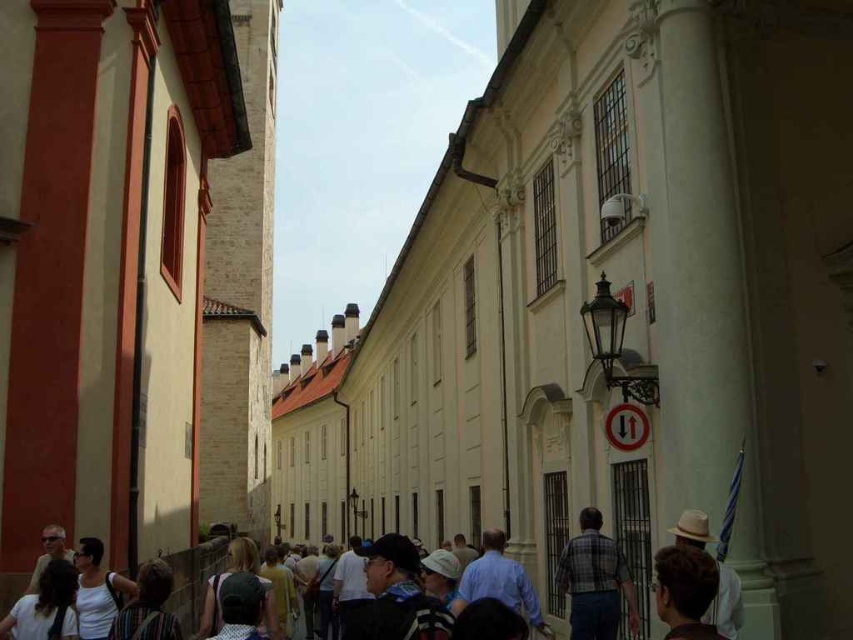
You are a tourist standing on the narrow street scene in a historic European city. You notice a dark brown hair at lower left. Where exactly is the dark brown hair located in the scene?

The dark brown hair at lower left is located at point coordinates of approximately 0.948 on the x axis and 0.054 on the y axis.

You are a delivery person carrying a package that is 1.2 meters wide. You see a dark blue jacket at center and a dark gray backpack at center in the middle of the narrow street. Can you pass through between them without moving the objects?

The dark blue jacket at center is narrower than the dark gray backpack at center. However, since both are at the center of the narrow street, their combined width may block the path. The package is 1.2 meters wide, but without knowing the exact spacing between the objects and the total available width, it is uncertain if the package can pass through safely.

You are a delivery person standing on the narrow street depicted in the image. You need to deliver a package to the building with the vertical red stripe on its left side. However, your delivery cart is 2 meters wide. Can you maneuver your cart between the dark brown hair at lower left and the matte black sunglasses at lower left without hitting either object?

The distance between the dark brown hair at lower left and the matte black sunglasses at lower left is 2.21 meters. Since your delivery cart is 2 meters wide, there is enough space to maneuver between them without hitting either object.